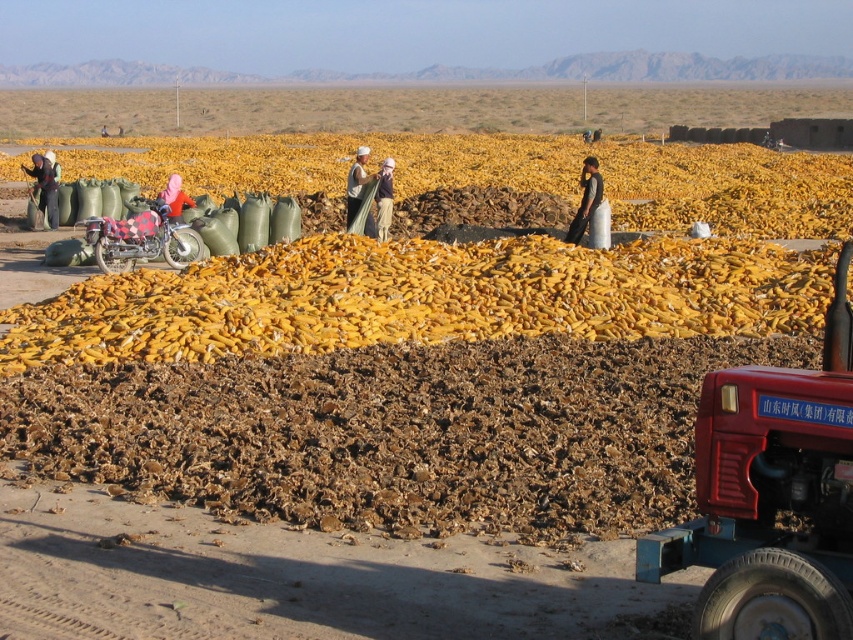
Between point (346, 204) and point (383, 168), which one is positioned behind?

The point (346, 204) is more distant.

Is light brown fabric at center shorter than matte white shirt at center?

No.

This screenshot has height=640, width=853. Identify the location of light brown fabric at center. coord(357,182).

Image resolution: width=853 pixels, height=640 pixels. Find the location of `light brown fabric at center`. light brown fabric at center is located at coordinates (357, 182).

Is light brown fabric at center thinner than pink fabric at center?

In fact, light brown fabric at center might be wider than pink fabric at center.

This screenshot has height=640, width=853. I want to click on light brown fabric at center, so click(357, 182).

Does point (181, 294) come in front of point (589, 177)?

Yes, point (181, 294) is in front of point (589, 177).

Image resolution: width=853 pixels, height=640 pixels. Describe the element at coordinates (421, 298) in the screenshot. I see `yellow matte corn at center` at that location.

Is point (693, 301) in front of point (573, 236)?

Yes, it is in front of point (573, 236).

Image resolution: width=853 pixels, height=640 pixels. I want to click on yellow matte corn at center, so click(421, 298).